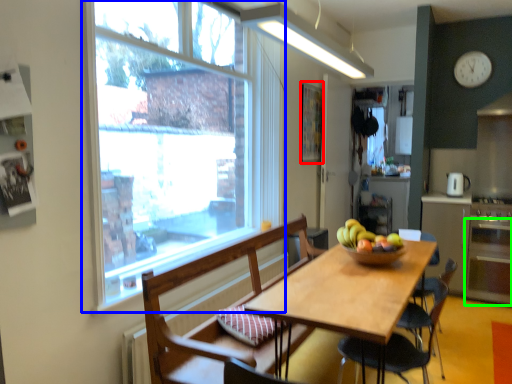
Question: Considering the real-world distances, which object is farthest from bulletin board (highlighted by a red box)? window (highlighted by a blue box) or oven (highlighted by a green box)?

Choices:
 (A) window
 (B) oven

Answer: (B)